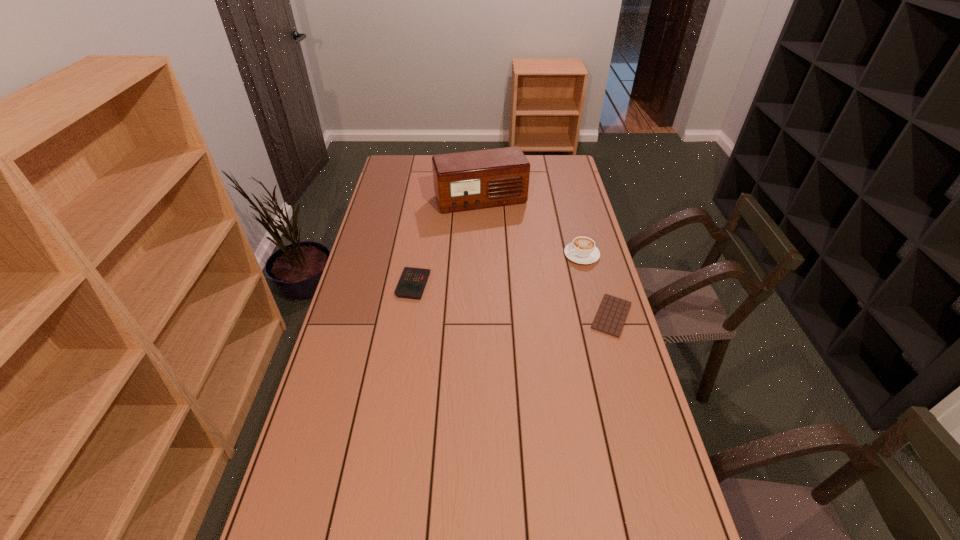
Find the location of a particular element. The height and width of the screenshot is (540, 960). vacant space located 0.260m on the side of the second tallest object with the handle is located at coordinates (509, 284).

Find the location of a particular element. free spot located on the front-facing side of the radio receiver is located at coordinates (497, 231).

Find the location of a particular element. The image size is (960, 540). free location located 0.380m on the front-facing side of the radio receiver is located at coordinates (516, 274).

I want to click on free location located 0.070m on the front-facing side of the radio receiver, so click(495, 225).

Where is `object that is positioned at the left edge`? This screenshot has height=540, width=960. object that is positioned at the left edge is located at coordinates (411, 285).

You are a GUI agent. You are given a task and a screenshot of the screen. Output one action in this format:
    pyautogui.click(x=<x>, y=<y>)
    Task: Click on the chocolate bar that is at the right edge
    
    Given the screenshot: What is the action you would take?
    pyautogui.click(x=610, y=318)

Locate an element on the screen. The image size is (960, 540). cappuccino that is at the right edge is located at coordinates (582, 250).

Where is `free space at the far edge of the desktop`? This screenshot has width=960, height=540. free space at the far edge of the desktop is located at coordinates (539, 178).

Where is `free space at the left edge of the desktop`? free space at the left edge of the desktop is located at coordinates (328, 424).

Identify the location of vacant space at the right edge of the desktop. This screenshot has width=960, height=540. (554, 224).